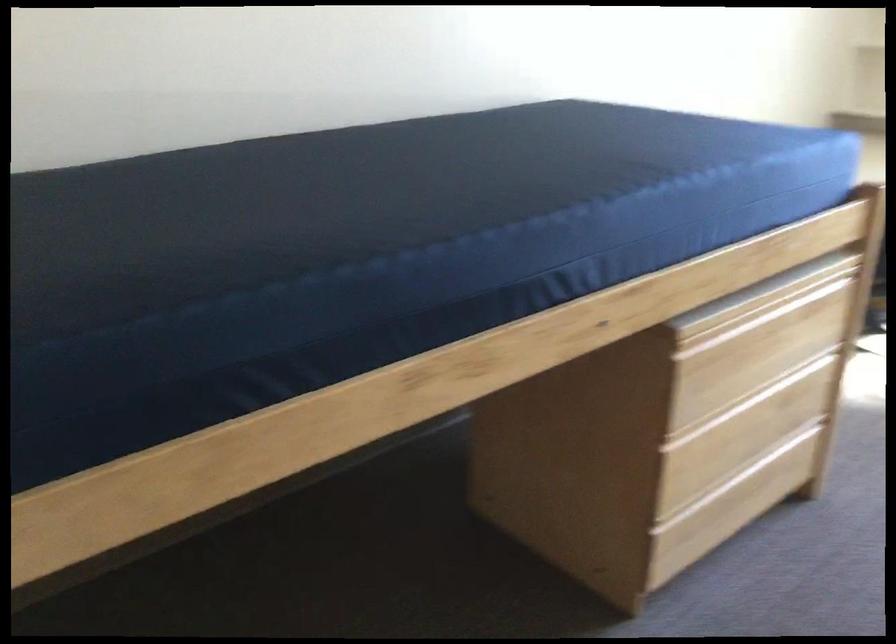
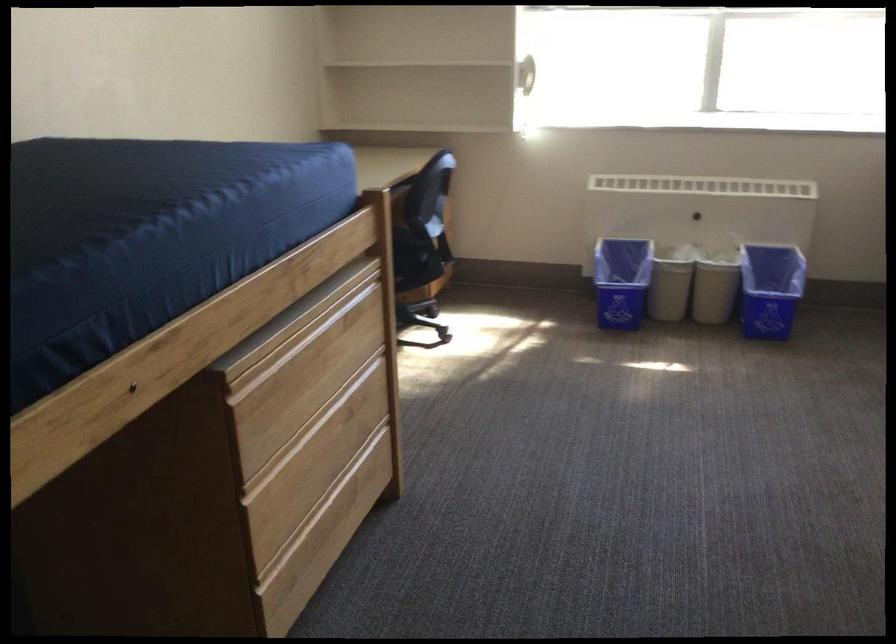
The point at [738,408] is marked in the first image. Where is the corresponding point in the second image?

(307, 431)